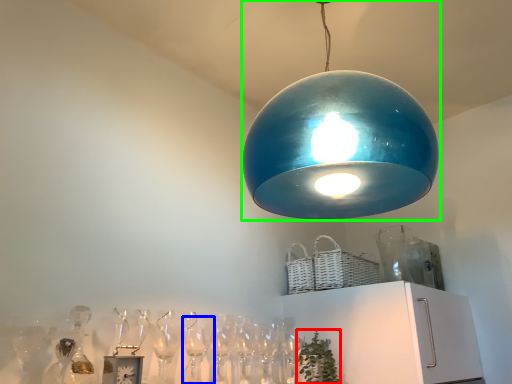
Question: Which object is positioned farthest from plant (highlighted by a red box)? Select from wine glass (highlighted by a blue box) and lamp (highlighted by a green box).

Choices:
 (A) wine glass
 (B) lamp

Answer: (B)